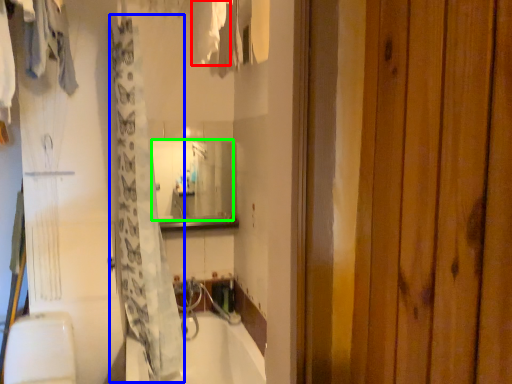
Question: Which is farther away from clothing (highlighted by a red box)? shower curtain (highlighted by a blue box) or mirror (highlighted by a green box)?

Choices:
 (A) shower curtain
 (B) mirror

Answer: (B)